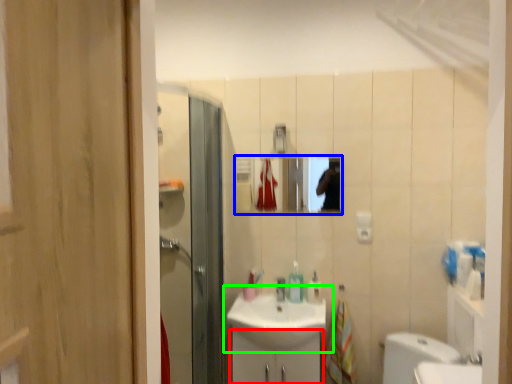
Question: Which object is positioned farthest from bathroom cabinet (highlighted by a red box)? Select from mirror (highlighted by a blue box) and sink (highlighted by a green box).

Choices:
 (A) mirror
 (B) sink

Answer: (A)